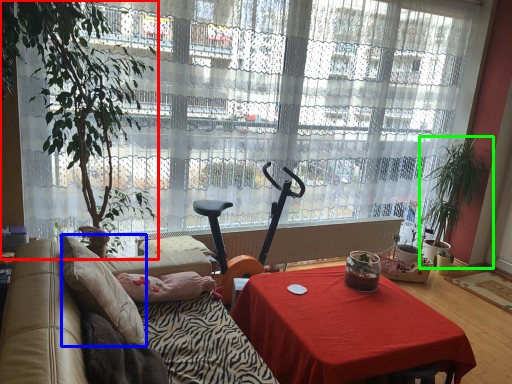
Question: Which is nearer to the houseplant (highlighted by a red box)? pillow (highlighted by a blue box) or houseplant (highlighted by a green box).

Choices:
 (A) pillow
 (B) houseplant

Answer: (A)